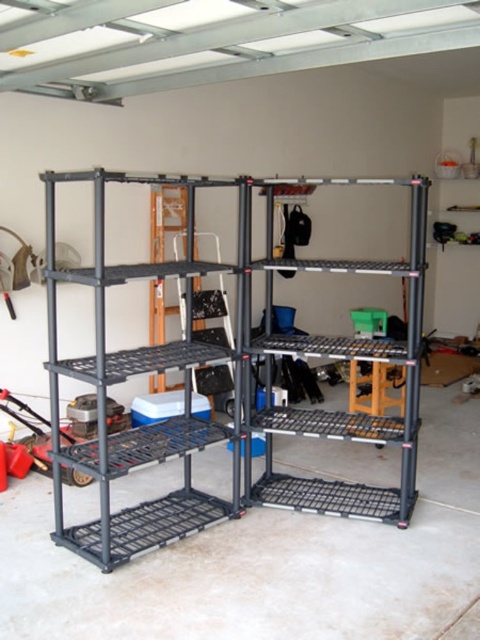
You are organizing tools in the garage and need to place a large box on the storage unit. Which one should you choose between the black metal shelf at center and the black wire shelving unit at center if you want to ensure the box fits properly?

The black wire shelving unit at center is larger in size than the black metal shelf at center, so you should choose the black wire shelving unit at center to ensure the large box fits properly.

You are organizing the garage and need to place a heavy tool box. The tool box is too heavy for the upper shelves. Which object from the black metal shelf at center and the black wire shelving unit at center should you choose to place it on?

The black metal shelf at center is below the black wire shelving unit at center. Since the tool box is too heavy for the upper shelves, you should place it on the black metal shelf at center because it is located lower and likely more sturdy for heavy items.